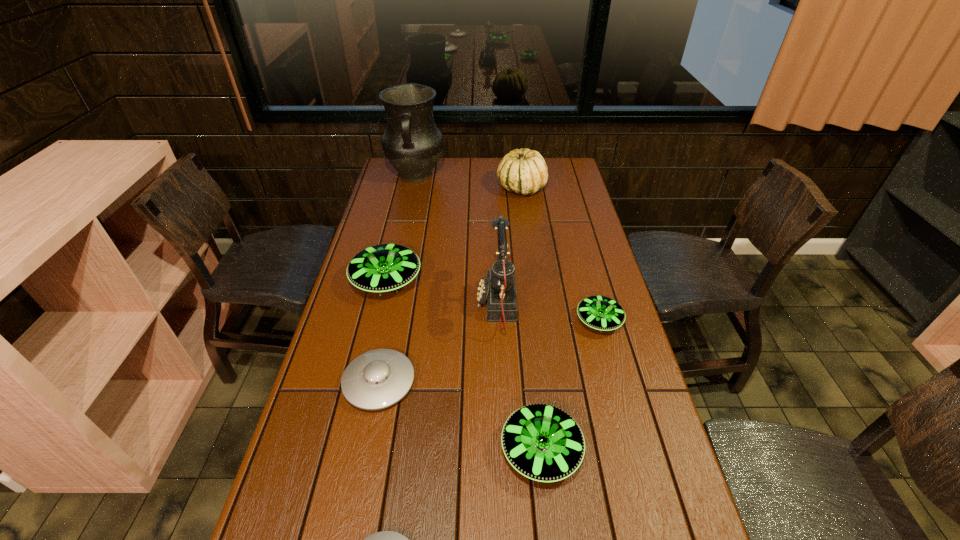
Where is `saucer object that ranks as the third closest to the third tallest object`? saucer object that ranks as the third closest to the third tallest object is located at coordinates (377, 379).

This screenshot has width=960, height=540. In order to click on green saucer identified as the second closest to the fourth shortest object in this screenshot , I will do `click(381, 268)`.

Identify the location of the closest green saucer to the bigger gray saucer. (381, 268).

I want to click on free location that satisfies the following two spatial constraints: 1. on the front side of the fourth shortest saucer; 2. on the right side of the farther gray saucer, so click(366, 450).

This screenshot has width=960, height=540. I want to click on free space that satisfies the following two spatial constraints: 1. on the handle side of the black pitcher; 2. on the left side of the white gourd, so click(x=413, y=188).